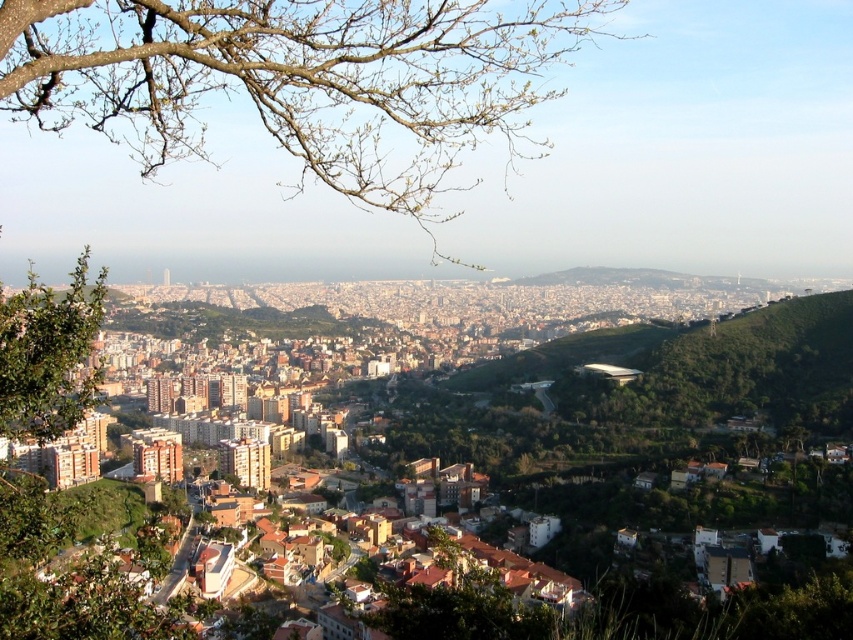
You are a drone operator flying a drone over the urban area. You need to deliver a package to the brown brick buildings at center. However, there is a green leafy tree at left in your flight path. Based on the scene description, will the drone have to ascend or descend to avoid the tree?

The brown brick buildings at center is located above green leafy tree at left, so the drone will need to ascend to reach the buildings while avoiding the tree below.

You are an urban planner reviewing this city layout. You need to determine the spatial relationship between the brown brick buildings at center and the green leafy tree at left. Which one is positioned to the right of the other?

The brown brick buildings at center are positioned to the right of the green leafy tree at left.